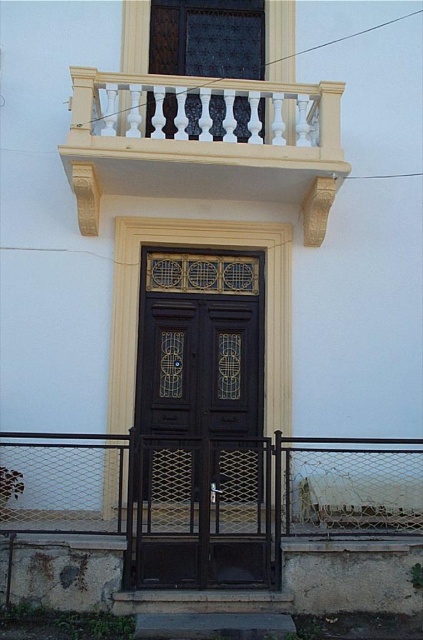
You are standing at the entrance of the building and want to look up to see the white carved wood balcony at upper center. Which side of the dark wood door at center should you look towards?

The dark wood door at center is positioned on the left side of the white carved wood balcony at upper center, so you should look towards the left side of the dark wood door at center to see the white carved wood balcony at upper center.

You are standing in front of the building entrance. Where is the dark wood door at center located in terms of its 2D coordinates?

The dark wood door at center is located at the 2D coordinates of point (200,422).

You are an architect evaluating the entrance of a building. You need to determine which object takes up more visual space in the composition. Which one is larger in size between the dark wood door at center and the white carved wood balcony at upper center?

The white carved wood balcony at upper center takes up more visual space than the dark wood door at center, as the dark wood door at center occupies less space than the white carved wood balcony at upper center.